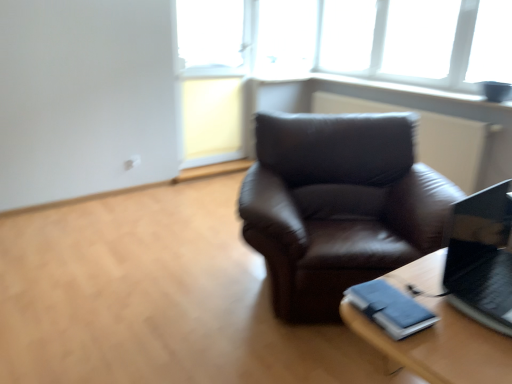
Describe the element at coordinates (440, 346) in the screenshot. I see `wooden table at lower right` at that location.

Identify the location of transparent glass window at upper center. The height and width of the screenshot is (384, 512). (351, 39).

Considering the sizes of shiny black laptop at right and transparent glass window at upper center in the image, is shiny black laptop at right taller or shorter than transparent glass window at upper center?

Considering their sizes, shiny black laptop at right has less height than transparent glass window at upper center.

Which object is positioned more to the right, shiny black laptop at right or transparent glass window at upper center?

transparent glass window at upper center.

Considering the relative sizes of shiny black laptop at right and transparent glass window at upper center in the image provided, is shiny black laptop at right smaller than transparent glass window at upper center?

Correct, shiny black laptop at right occupies less space than transparent glass window at upper center.

From the image's perspective, is wooden table at lower right located above or below shiny black laptop at right?

From the image's perspective, wooden table at lower right appears below shiny black laptop at right.

Is wooden table at lower right shorter than shiny black laptop at right?

Incorrect, the height of wooden table at lower right does not fall short of that of shiny black laptop at right.

Is wooden table at lower right beside shiny black laptop at right?

wooden table at lower right and shiny black laptop at right are not in contact.

Is wooden table at lower right oriented away from shiny black laptop at right?

No, wooden table at lower right is not facing away from shiny black laptop at right.

How different are the orientations of shiny black laptop at right and wooden table at lower right in degrees?

The angular difference between shiny black laptop at right and wooden table at lower right is 0.693 degrees.

In the scene shown: Which of these two, shiny black laptop at right or wooden table at lower right, is smaller?

With smaller size is shiny black laptop at right.

Do you think shiny black laptop at right is within wooden table at lower right, or outside of it?

shiny black laptop at right lies outside wooden table at lower right.

Considering the sizes of objects shiny black laptop at right and wooden table at lower right in the image provided, who is shorter, shiny black laptop at right or wooden table at lower right?

shiny black laptop at right.

Is the depth of transparent glass window at upper center greater than that of blue fabric binder at lower right?

Yes, it is.

From a real-world perspective, between transparent glass window at upper center and blue fabric binder at lower right, who is vertically higher?

In real-world perspective, transparent glass window at upper center is above.

Locate an element on the screen. window that appears above the blue fabric binder at lower right (from the image's perspective) is located at coordinates (351, 39).

Is transparent glass window at upper center looking in the opposite direction of blue fabric binder at lower right?

No, transparent glass window at upper center's orientation is not away from blue fabric binder at lower right.

Who is bigger, blue fabric binder at lower right or wooden table at lower right?

wooden table at lower right.

The image size is (512, 384). I want to click on table that is on the right side of blue fabric binder at lower right, so pyautogui.click(x=440, y=346).

From the image's perspective, is blue fabric binder at lower right on wooden table at lower right?

Indeed, from the image's perspective, blue fabric binder at lower right is shown above wooden table at lower right.

Which is correct: blue fabric binder at lower right is inside wooden table at lower right, or outside of it?

blue fabric binder at lower right exists outside the volume of wooden table at lower right.

Which is more to the right, transparent glass window at upper center or wooden table at lower right?

transparent glass window at upper center.

Is transparent glass window at upper center aimed at wooden table at lower right?

No, transparent glass window at upper center is not facing towards wooden table at lower right.

Which of these two, transparent glass window at upper center or wooden table at lower right, is wider?

With larger width is wooden table at lower right.

From their relative heights in the image, would you say transparent glass window at upper center is taller or shorter than wooden table at lower right?

Clearly, transparent glass window at upper center is taller compared to wooden table at lower right.

Does wooden table at lower right have a larger size compared to transparent glass window at upper center?

Correct, wooden table at lower right is larger in size than transparent glass window at upper center.

In the scene shown: Can you see wooden table at lower right touching transparent glass window at upper center?

No, wooden table at lower right is not making contact with transparent glass window at upper center.

From the image's perspective, which one is positioned lower, wooden table at lower right or transparent glass window at upper center?

wooden table at lower right.

Between wooden table at lower right and transparent glass window at upper center, which one has larger width?

With larger width is wooden table at lower right.

This screenshot has width=512, height=384. In order to click on laptop on the left of transparent glass window at upper center in this screenshot , I will do `click(481, 258)`.

In order to click on table below the shiny black laptop at right (from the image's perspective) in this screenshot , I will do `click(440, 346)`.

Based on their spatial positions, is transparent glass window at upper center or wooden table at lower right closer to shiny black laptop at right?

wooden table at lower right.

Estimate the real-world distances between objects in this image. Which object is further from shiny black laptop at right, blue fabric binder at lower right or transparent glass window at upper center?

Among the two, transparent glass window at upper center is located further to shiny black laptop at right.

From the image, which object appears to be nearer to wooden table at lower right, shiny black laptop at right or transparent glass window at upper center?

shiny black laptop at right is closer to wooden table at lower right.

Looking at the image, which one is located further to transparent glass window at upper center, blue fabric binder at lower right or wooden table at lower right?

blue fabric binder at lower right.

From the picture: From the image, which object appears to be farther from transparent glass window at upper center, blue fabric binder at lower right or shiny black laptop at right?

blue fabric binder at lower right.

Considering their positions, is wooden table at lower right positioned closer to transparent glass window at upper center than shiny black laptop at right?

shiny black laptop at right is positioned closer to the anchor transparent glass window at upper center.

Based on their spatial positions, is shiny black laptop at right or wooden table at lower right further from transparent glass window at upper center?

wooden table at lower right is positioned further to the anchor transparent glass window at upper center.

From the image, which object appears to be nearer to shiny black laptop at right, blue fabric binder at lower right or wooden table at lower right?

Based on the image, wooden table at lower right appears to be nearer to shiny black laptop at right.

This screenshot has height=384, width=512. Find the location of `binder positioned between shiny black laptop at right and transparent glass window at upper center from near to far`. binder positioned between shiny black laptop at right and transparent glass window at upper center from near to far is located at coordinates (390, 308).

Image resolution: width=512 pixels, height=384 pixels. Identify the location of laptop positioned between wooden table at lower right and transparent glass window at upper center from near to far. (481, 258).

The image size is (512, 384). In order to click on laptop between blue fabric binder at lower right and wooden table at lower right from left to right in this screenshot , I will do `click(481, 258)`.

Where is `binder located between wooden table at lower right and transparent glass window at upper center in the depth direction`? This screenshot has width=512, height=384. binder located between wooden table at lower right and transparent glass window at upper center in the depth direction is located at coordinates (390, 308).